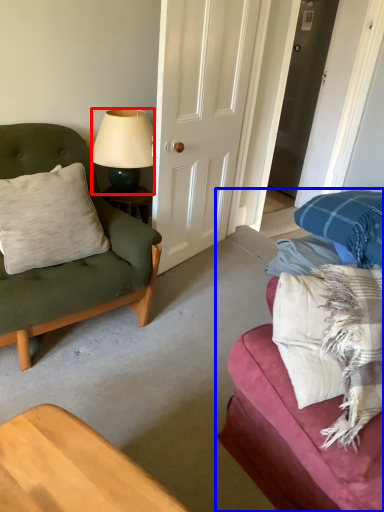
Question: Which of the following is the farthest to the observer, lamp (highlighted by a red box) or studio couch (highlighted by a blue box)?

Choices:
 (A) lamp
 (B) studio couch

Answer: (A)